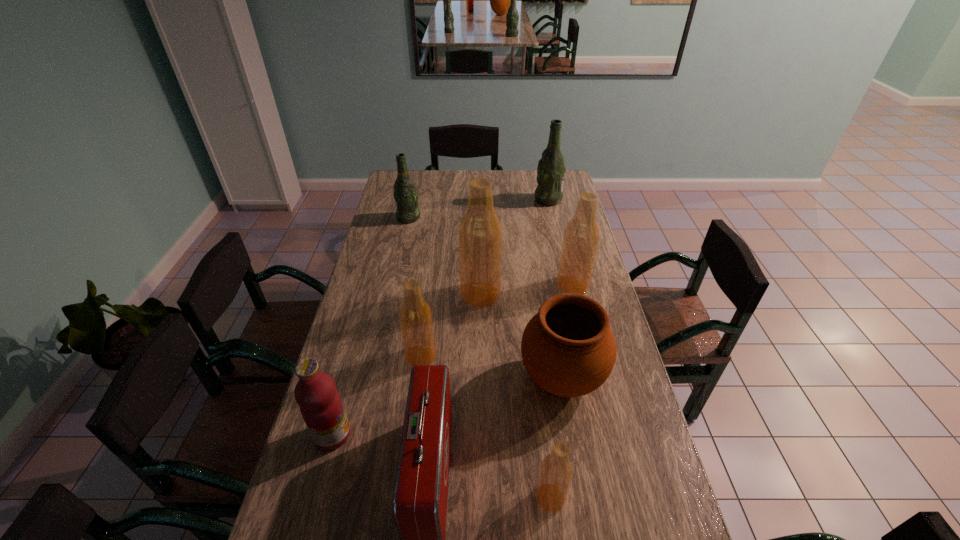
Identify which beer bottle is the fourth closest to the second farthest beer bottle. Please provide its 2D coordinates. Your answer should be formatted as a tuple, i.e. [(x, y)], where the tuple contains the x and y coordinates of a point satisfying the conditions above.

[(415, 315)]

This screenshot has width=960, height=540. I want to click on beer bottle that is the third nearest to the eighth nearest object, so click(x=581, y=238).

Select which tan beer bottle appears as the second closest to the red first-aid kit. Please provide its 2D coordinates. Your answer should be formatted as a tuple, i.e. [(x, y)], where the tuple contains the x and y coordinates of a point satisfying the conditions above.

[(556, 471)]

Identify which tan beer bottle is located as the second nearest to the shortest beer bottle. Please provide its 2D coordinates. Your answer should be formatted as a tuple, i.e. [(x, y)], where the tuple contains the x and y coordinates of a point satisfying the conditions above.

[(480, 232)]

Identify which green beer bottle is the second nearest to the second nearest beer bottle. Please provide its 2D coordinates. Your answer should be formatted as a tuple, i.e. [(x, y)], where the tuple contains the x and y coordinates of a point satisfying the conditions above.

[(551, 169)]

Identify the location of vacant position in the image that satisfies the following two spatial constraints: 1. on the surface of the smaller green beer bottle; 2. on the left side of the leftmost tan beer bottle. (378, 356).

The height and width of the screenshot is (540, 960). Identify the location of free space that satisfies the following two spatial constraints: 1. on the surface of the nearest tan beer bottle; 2. on the right side of the nearer green beer bottle. (348, 497).